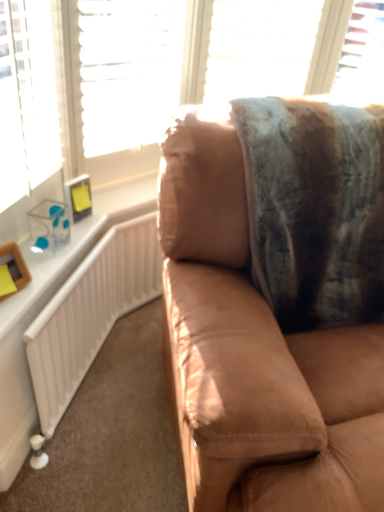
Question: Would you say white textured blind at upper center is to the left or to the right of transparent plastic window at upper right in the picture?

Choices:
 (A) left
 (B) right

Answer: (A)

Question: Considering the positions of white textured blind at upper center and transparent plastic window at upper right in the image, is white textured blind at upper center bigger or smaller than transparent plastic window at upper right?

Choices:
 (A) big
 (B) small

Answer: (A)

Question: Estimate the real-world distances between objects in this image. Which object is farther from the transparent plastic window at upper right?

Choices:
 (A) white textured blind at upper center
 (B) suede brown couch at center
 (C) white glossy radiator at left
 (D) fuzzy woolen blanket at upper right

Answer: (C)

Question: Which object is the farthest from the white glossy radiator at left?

Choices:
 (A) fuzzy woolen blanket at upper right
 (B) suede brown couch at center
 (C) white textured blind at upper center
 (D) transparent plastic window at upper right

Answer: (D)